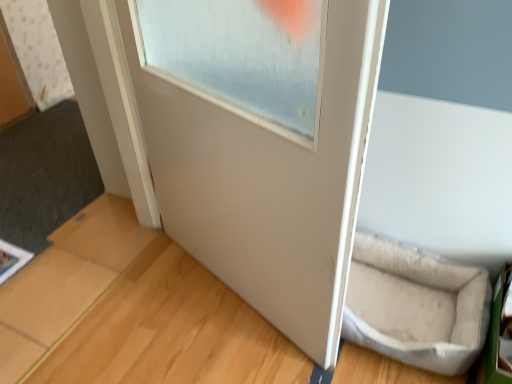
Question: Does beige fabric pet bed at lower right have a greater height compared to white matte door frame at upper left?

Choices:
 (A) no
 (B) yes

Answer: (A)

Question: Is the depth of beige fabric pet bed at lower right greater than that of white matte door frame at upper left?

Choices:
 (A) yes
 (B) no

Answer: (B)

Question: Does beige fabric pet bed at lower right appear on the right side of white matte door frame at upper left?

Choices:
 (A) yes
 (B) no

Answer: (A)

Question: Is beige fabric pet bed at lower right bigger than white matte door frame at upper left?

Choices:
 (A) yes
 (B) no

Answer: (B)

Question: Can you confirm if beige fabric pet bed at lower right is smaller than white matte door frame at upper left?

Choices:
 (A) yes
 (B) no

Answer: (A)

Question: Is white matte door frame at upper left located within beige fabric pet bed at lower right?

Choices:
 (A) no
 (B) yes

Answer: (A)

Question: Is white matte door at center in front of light brown wood at lower right?

Choices:
 (A) no
 (B) yes

Answer: (B)

Question: From the image's perspective, is white matte door at center on light brown wood at lower right?

Choices:
 (A) yes
 (B) no

Answer: (A)

Question: Is white matte door at center positioned with its back to light brown wood at lower right?

Choices:
 (A) no
 (B) yes

Answer: (A)

Question: Is white matte door at center thinner than light brown wood at lower right?

Choices:
 (A) yes
 (B) no

Answer: (A)

Question: Is white matte door at center to the left of light brown wood at lower right from the viewer's perspective?

Choices:
 (A) no
 (B) yes

Answer: (B)

Question: Is white matte door at center in contact with light brown wood at lower right?

Choices:
 (A) no
 (B) yes

Answer: (A)

Question: Is white matte door at center thinner than beige fabric pet bed at lower right?

Choices:
 (A) yes
 (B) no

Answer: (A)